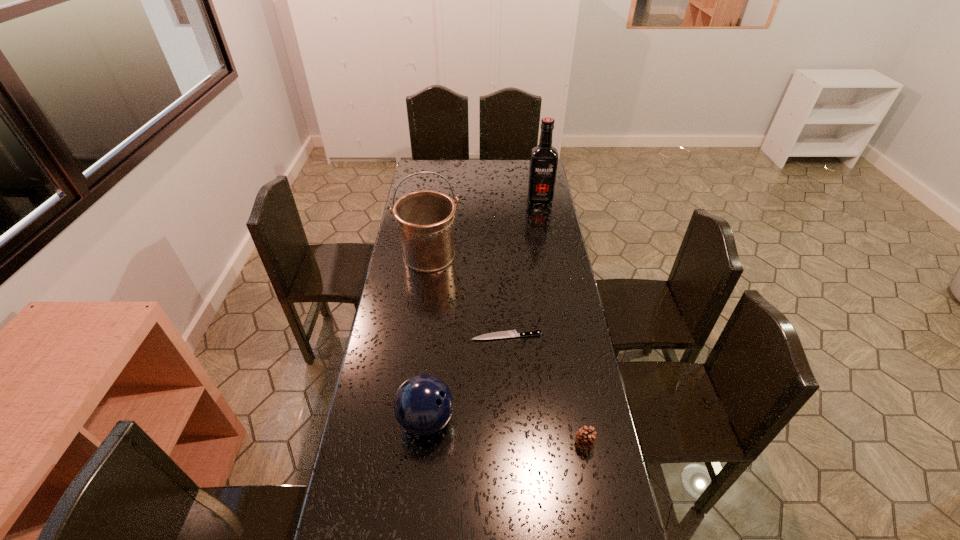
At what (x,y) coordinates should I click in order to perform the action: click on the third closest object to the pinecone. Please return your answer as a coordinate pair (x, y). The height and width of the screenshot is (540, 960). Looking at the image, I should click on (425, 219).

Identify the location of free space that satisfies the following two spatial constraints: 1. on the back side of the pinecone; 2. on the surface of the bowling ball near the finger holes. The width and height of the screenshot is (960, 540). (580, 420).

What are the coordinates of `free space that satisfies the following two spatial constraints: 1. on the front-facing side of the farthest object; 2. on the surface of the bowling ball near the finger holes` in the screenshot? It's located at (579, 420).